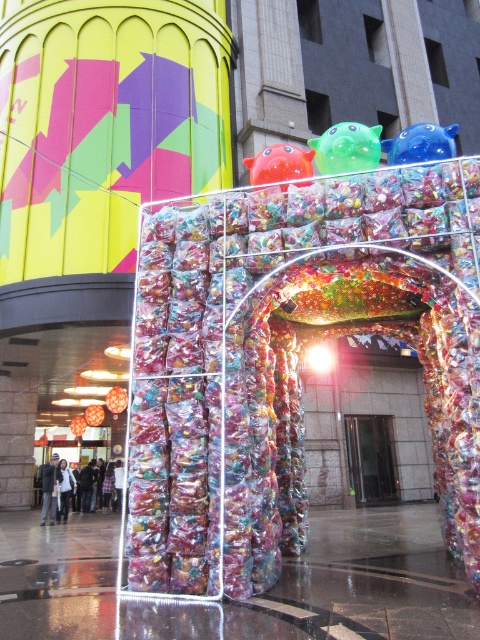
You are an artist planning to photograph the blue glossy toy at upper right and the glossy plastic ball at upper center. To ensure both are in frame, you need to know their relative positions. Which object is located to the right of the other?

The blue glossy toy at upper right is positioned on the right side of the glossy plastic ball at upper center, so the blue glossy toy at upper right is to the right of the glossy plastic ball at upper center.